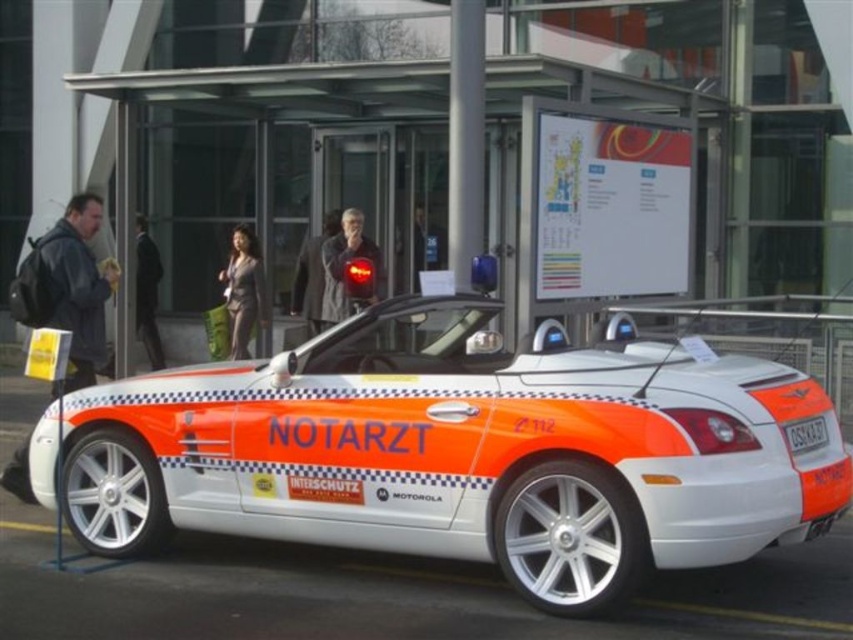
You are standing at the point labeled point (457, 451). Looking around, you see a white metallic car at center. Which direction should you move to reach the white metallic car at center?

The point labeled point (457, 451) corresponds to the white metallic car at center, so you are already at the white metallic car at center.

You are standing next to a camera that is 1.5 meters wide. You want to take a photo of the white metallic car at center without the camera blocking the view. Is there enough space between you and the car to do this?

The distance between the white metallic car at center and the camera is 4.73 meters. Since the camera is only 1.5 meters wide, there is sufficient space to position yourself behind the camera and still have enough room to take a clear photo without obstruction.